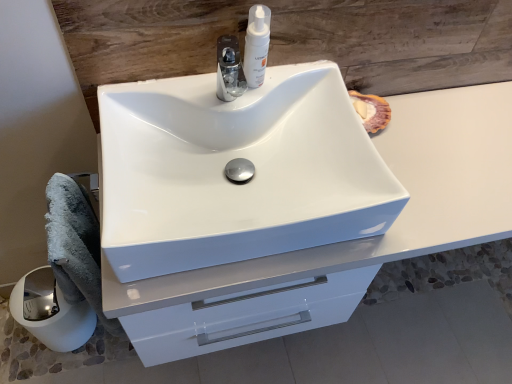
Image resolution: width=512 pixels, height=384 pixels. Find the location of `gray fluffy bath towel at lower left`. gray fluffy bath towel at lower left is located at coordinates (76, 246).

Where is `white glossy cabinet at center`? white glossy cabinet at center is located at coordinates (402, 211).

What's the angular difference between white glossy pump at upper center and white glossy sink at center's facing directions?

The angle between the facing direction of white glossy pump at upper center and the facing direction of white glossy sink at center is 2.53 degrees.

From the image's perspective, would you say white glossy pump at upper center is positioned over white glossy sink at center?

Correct, white glossy pump at upper center appears higher than white glossy sink at center in the image.

Is white glossy pump at upper center oriented away from white glossy sink at center?

white glossy pump at upper center is not turned away from white glossy sink at center.

Is white glossy paper towel at lower left bigger than white glossy pump at upper center?

Correct, white glossy paper towel at lower left is larger in size than white glossy pump at upper center.

Considering the positions of points (46, 286) and (257, 23), is point (46, 286) farther from camera compared to point (257, 23)?

Yes.

Does white glossy paper towel at lower left appear on the right side of white glossy pump at upper center?

No.

Does white glossy paper towel at lower left come in front of white glossy pump at upper center?

No.

Can you tell me how much white glossy pump at upper center and white glossy paper towel at lower left differ in facing direction?

3.08 degrees.

From the image's perspective, would you say white glossy pump at upper center is positioned over white glossy paper towel at lower left?

Yes, from the image's perspective, white glossy pump at upper center is over white glossy paper towel at lower left.

Locate an element on the screen. This screenshot has height=384, width=512. paper towel behind the white glossy pump at upper center is located at coordinates (51, 312).

In terms of height, does white glossy pump at upper center look taller or shorter compared to white glossy paper towel at lower left?

Clearly, white glossy pump at upper center is shorter compared to white glossy paper towel at lower left.

Based on their sizes in the image, would you say white glossy cabinet at center is bigger or smaller than white glossy sink at center?

white glossy cabinet at center is bigger than white glossy sink at center.

From the picture: Is the depth of white glossy cabinet at center less than that of white glossy sink at center?

No, white glossy cabinet at center is further to the viewer.

Would you say white glossy cabinet at center is outside white glossy sink at center?

white glossy cabinet at center lies outside white glossy sink at center's area.

From the image's perspective, between white glossy cabinet at center and white glossy sink at center, who is located below?

white glossy cabinet at center appears lower in the image.

How many degrees apart are the facing directions of white glossy cabinet at center and white glossy paper towel at lower left?

0.552 degrees.

Is white glossy cabinet at center oriented away from white glossy paper towel at lower left?

No, white glossy cabinet at center's orientation is not away from white glossy paper towel at lower left.

From the picture: Would you say white glossy cabinet at center is to the left or to the right of white glossy paper towel at lower left in the picture?

Clearly, white glossy cabinet at center is on the right of white glossy paper towel at lower left in the image.

You are a GUI agent. You are given a task and a screenshot of the screen. Output one action in this format:
    pyautogui.click(x=<x>, y=<y>)
    Task: Click on the bath towel lying behind the white glossy cabinet at center
    This screenshot has width=512, height=384.
    Given the screenshot: What is the action you would take?
    pyautogui.click(x=76, y=246)

Does white glossy cabinet at center have a smaller size compared to gray fluffy bath towel at lower left?

No, white glossy cabinet at center is not smaller than gray fluffy bath towel at lower left.

Between white glossy cabinet at center and gray fluffy bath towel at lower left, which one has smaller width?

With smaller width is gray fluffy bath towel at lower left.

Is white glossy cabinet at center next to gray fluffy bath towel at lower left and touching it?

No, white glossy cabinet at center is not touching gray fluffy bath towel at lower left.

From a real-world perspective, which object rests below the other?

gray fluffy bath towel at lower left is physically lower.

Between white glossy sink at center and gray fluffy bath towel at lower left, which one appears on the right side from the viewer's perspective?

white glossy sink at center.

From the image's perspective, is white glossy sink at center on gray fluffy bath towel at lower left?

Yes, from the image's perspective, white glossy sink at center is above gray fluffy bath towel at lower left.

Identify the location of soap dispenser on the right of white glossy sink at center. (256, 45).

At what (x,y) coordinates should I click in order to perform the action: click on soap dispenser that is above the white glossy paper towel at lower left (from a real-world perspective). Please return your answer as a coordinate pair (x, y). Image resolution: width=512 pixels, height=384 pixels. Looking at the image, I should click on (256, 45).

Which object lies nearer to the anchor point white glossy cabinet at center, white glossy pump at upper center or white glossy paper towel at lower left?

white glossy pump at upper center is closer to white glossy cabinet at center.

Considering their positions, is white glossy pump at upper center positioned closer to gray fluffy bath towel at lower left than white glossy cabinet at center?

white glossy cabinet at center is positioned closer to the anchor gray fluffy bath towel at lower left.

Based on their spatial positions, is white glossy cabinet at center or white glossy pump at upper center closer to gray fluffy bath towel at lower left?

white glossy cabinet at center is closer to gray fluffy bath towel at lower left.

Considering their positions, is white glossy cabinet at center positioned further to white glossy pump at upper center than white glossy paper towel at lower left?

white glossy paper towel at lower left lies further to white glossy pump at upper center than the other object.

When comparing their distances from white glossy cabinet at center, does gray fluffy bath towel at lower left or white glossy paper towel at lower left seem further?

The object further to white glossy cabinet at center is white glossy paper towel at lower left.

Considering their positions, is white glossy cabinet at center positioned closer to white glossy pump at upper center than white glossy sink at center?

white glossy sink at center is closer to white glossy pump at upper center.

From the image, which object appears to be nearer to white glossy pump at upper center, white glossy cabinet at center or gray fluffy bath towel at lower left?

Based on the image, white glossy cabinet at center appears to be nearer to white glossy pump at upper center.

Which object lies further to the anchor point white glossy pump at upper center, white glossy paper towel at lower left or white glossy cabinet at center?

white glossy paper towel at lower left.

Locate an element on the screen. The width and height of the screenshot is (512, 384). bath towel between white glossy paper towel at lower left and white glossy sink at center from left to right is located at coordinates (76, 246).

Find the location of a particular element. The width and height of the screenshot is (512, 384). soap dispenser between white glossy paper towel at lower left and white glossy cabinet at center from left to right is located at coordinates (256, 45).

Identify the location of sink located between gray fluffy bath towel at lower left and white glossy pump at upper center in the left-right direction. pos(233,173).

At what (x,y) coordinates should I click in order to perform the action: click on soap dispenser located between gray fluffy bath towel at lower left and white glossy cabinet at center in the left-right direction. Please return your answer as a coordinate pair (x, y). Looking at the image, I should click on point(256,45).